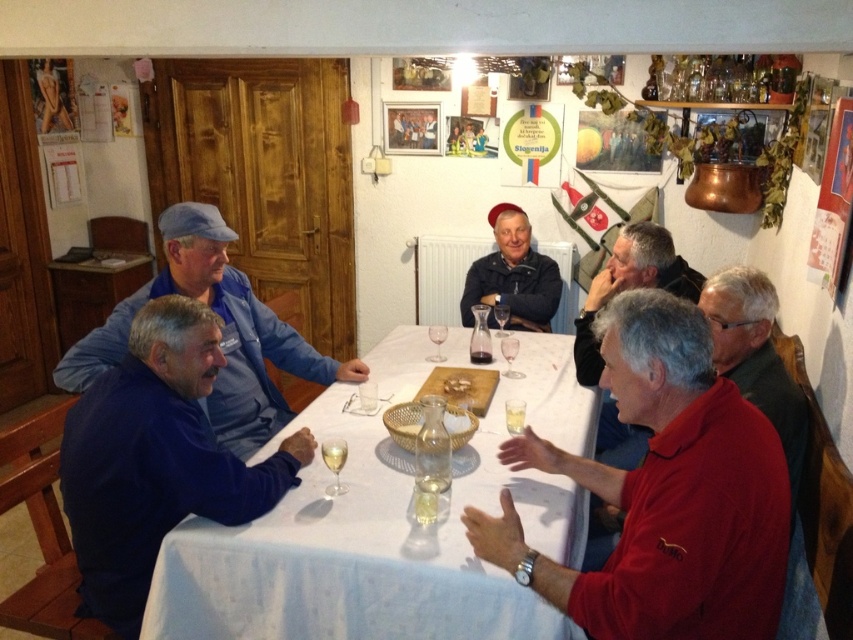
Does clear glass wine glass at lower center appear on the left side of white ceramic plate at center?

Indeed, clear glass wine glass at lower center is positioned on the left side of white ceramic plate at center.

Between clear glass wine glass at lower center and white ceramic plate at center, which one is positioned higher?

white ceramic plate at center is above.

Which is in front, point (326, 464) or point (459, 394)?

Point (326, 464) is more forward.

In order to click on clear glass wine glass at lower center in this screenshot , I will do `click(334, 464)`.

Is clear glass wine glass at center smaller than translucent glass wine at center?

Actually, clear glass wine glass at center might be larger than translucent glass wine at center.

Between clear glass wine glass at center and translucent glass wine at center, which one has more height?

With more height is clear glass wine glass at center.

You are a GUI agent. You are given a task and a screenshot of the screen. Output one action in this format:
    pyautogui.click(x=<x>, y=<y>)
    Task: Click on the clear glass wine glass at center
    The height and width of the screenshot is (640, 853).
    Given the screenshot: What is the action you would take?
    pyautogui.click(x=509, y=355)

Where is `clear glass wine glass at center`? The height and width of the screenshot is (640, 853). clear glass wine glass at center is located at coordinates (509, 355).

Is red matte shirt at center shorter than matte black jacket at center?

Correct, red matte shirt at center is not as tall as matte black jacket at center.

Can you confirm if red matte shirt at center is positioned to the left of matte black jacket at center?

Correct, you'll find red matte shirt at center to the left of matte black jacket at center.

Where is `red matte shirt at center`? The height and width of the screenshot is (640, 853). red matte shirt at center is located at coordinates tap(663, 493).

The image size is (853, 640). I want to click on red matte shirt at center, so click(x=663, y=493).